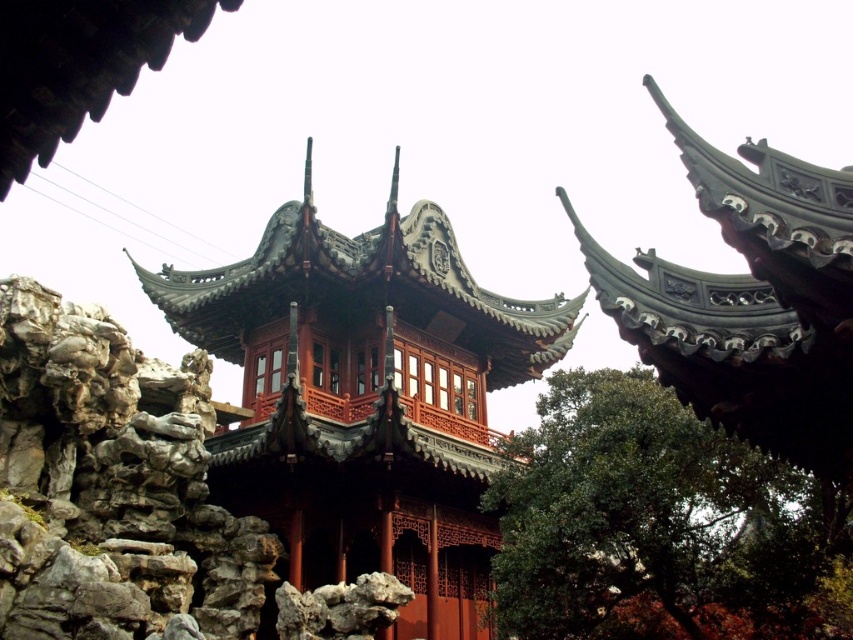
Question: Which object appears closest to the camera in this image?

Choices:
 (A) matte red wooden pavilion at center
 (B) green leafy tree at center
 (C) rockymaterial/texture at left

Answer: (C)

Question: Which object is positioned farthest from the green leafy tree at center?

Choices:
 (A) matte red wooden pavilion at center
 (B) rockymaterial/texture at left

Answer: (B)

Question: From the image, what is the correct spatial relationship of rockymaterial/texture at left in relation to green leafy tree at center?

Choices:
 (A) right
 (B) left

Answer: (B)

Question: Can you confirm if matte red wooden pavilion at center is positioned below green leafy tree at center?

Choices:
 (A) yes
 (B) no

Answer: (B)

Question: Can you confirm if matte red wooden pavilion at center is positioned to the right of rockymaterial/texture at left?

Choices:
 (A) yes
 (B) no

Answer: (A)

Question: Which point is closer to the camera taking this photo?

Choices:
 (A) (283, 461)
 (B) (119, 524)
 (C) (577, 627)

Answer: (B)